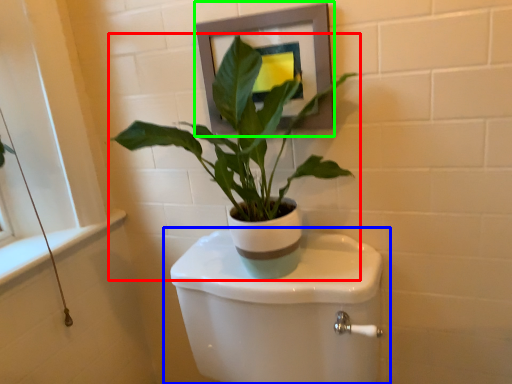
Question: Which is nearer to the houseplant (highlighted by a red box)? toilet (highlighted by a blue box) or picture frame (highlighted by a green box).

Choices:
 (A) toilet
 (B) picture frame

Answer: (B)